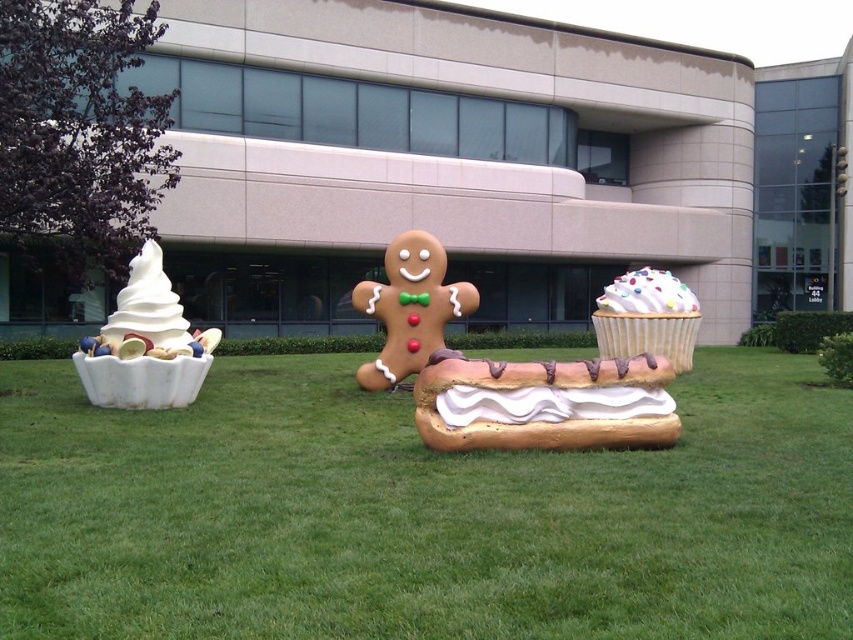
Who is positioned more to the left, green grass at center or white matte ice cream at left?

Positioned to the left is white matte ice cream at left.

Can you confirm if green grass at center is positioned above white matte ice cream at left?

No.

Is point (531, 461) in front of point (167, 320)?

Yes, it is in front of point (167, 320).

Locate an element on the screen. The height and width of the screenshot is (640, 853). green grass at center is located at coordinates (419, 513).

Is white matte hot dog at center behind white frosted cupcake at center?

No, it is in front of white frosted cupcake at center.

Does white matte hot dog at center have a greater height compared to white frosted cupcake at center?

Indeed, white matte hot dog at center has a greater height compared to white frosted cupcake at center.

This screenshot has width=853, height=640. What do you see at coordinates (543, 403) in the screenshot?
I see `white matte hot dog at center` at bounding box center [543, 403].

You are a GUI agent. You are given a task and a screenshot of the screen. Output one action in this format:
    pyautogui.click(x=<x>, y=<y>)
    Task: Click on the white matte hot dog at center
    
    Given the screenshot: What is the action you would take?
    pyautogui.click(x=543, y=403)

Which is more to the left, white matte ice cream cone at left or white glossy cupcake at center right?

white matte ice cream cone at left

What do you see at coordinates (144, 344) in the screenshot? I see `white matte ice cream cone at left` at bounding box center [144, 344].

Image resolution: width=853 pixels, height=640 pixels. In order to click on white matte ice cream cone at left in this screenshot , I will do `click(144, 344)`.